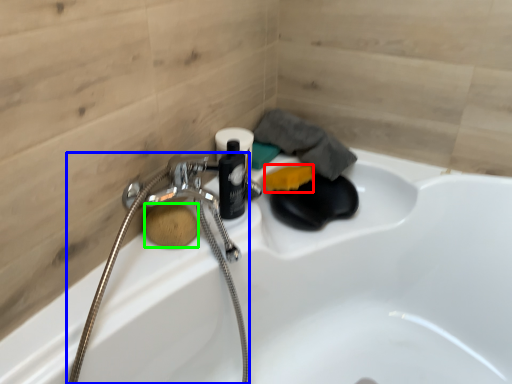
Question: Estimate the real-world distances between objects in this image. Which object is farther from soap (highlighted by a red box), garden hose (highlighted by a blue box) or soap (highlighted by a green box)?

Choices:
 (A) garden hose
 (B) soap

Answer: (B)